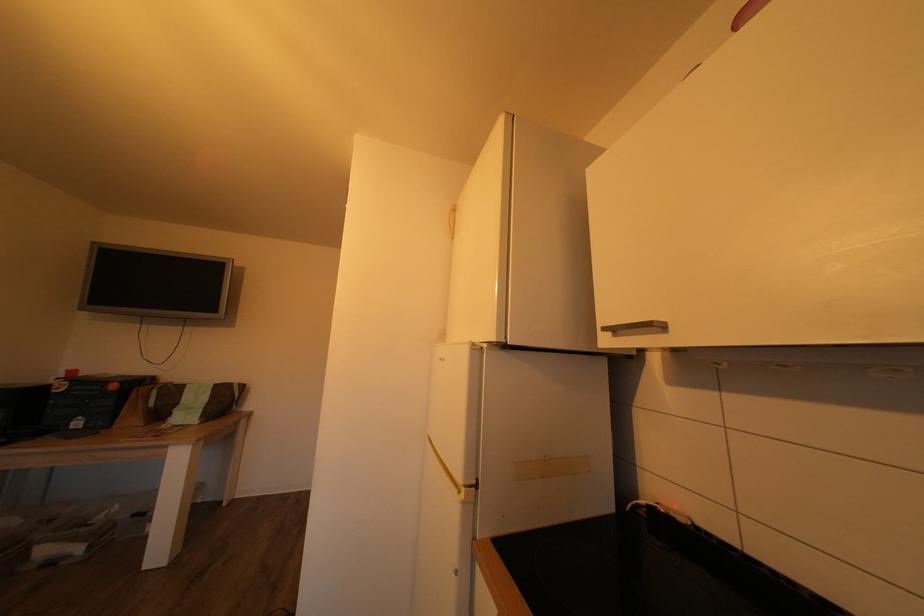
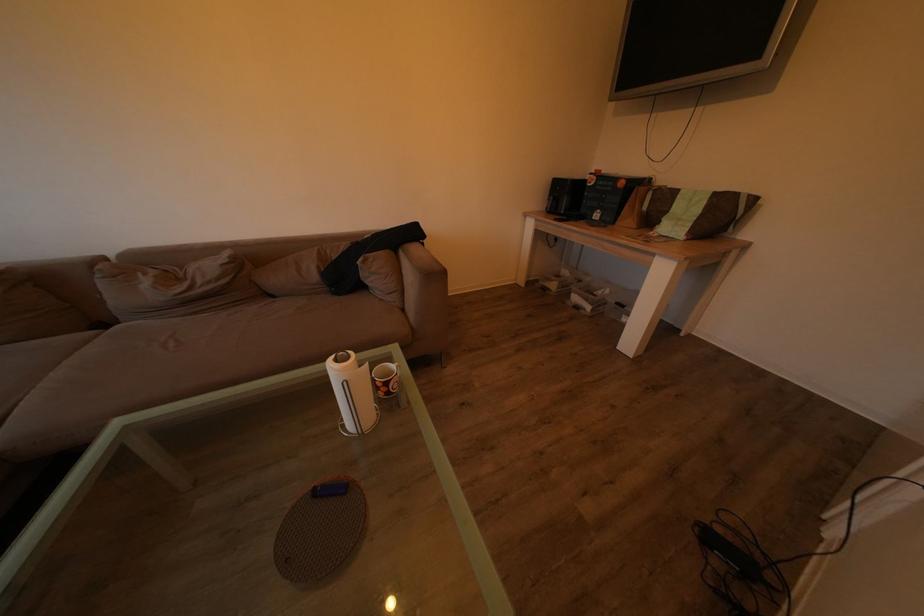
The first image is from the beginning of the video and the second image is from the end. How did the camera likely rotate when shooting the video?

The camera's rotation is toward left-down.